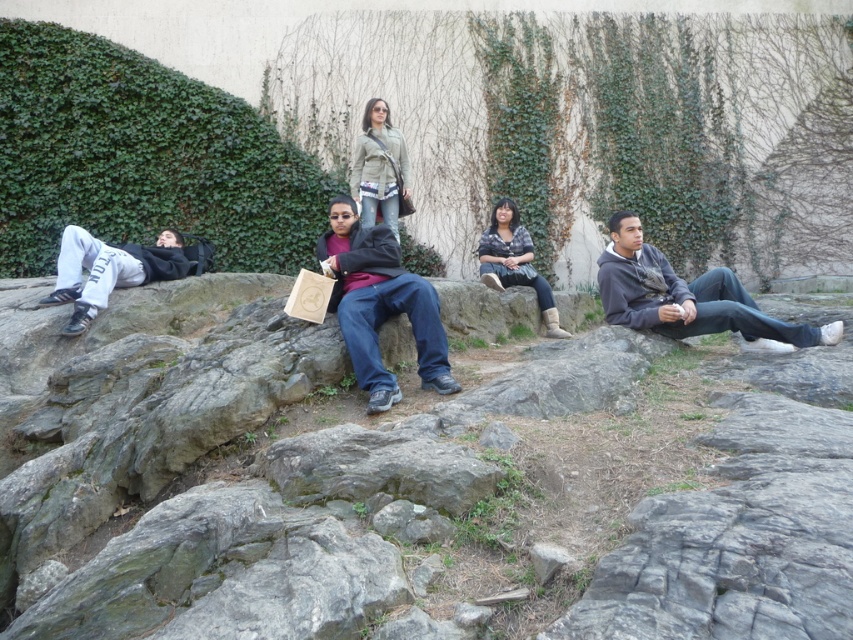
Is gray rock at center below matte green jacket at center?

Yes, gray rock at center is below matte green jacket at center.

Does point (366, 435) come in front of point (390, 184)?

Yes, point (366, 435) is in front of point (390, 184).

You are a GUI agent. You are given a task and a screenshot of the screen. Output one action in this format:
    pyautogui.click(x=<x>, y=<y>)
    Task: Click on the gray rock at center
    
    Given the screenshot: What is the action you would take?
    pyautogui.click(x=426, y=492)

Is matte black jacket at center above matte green jacket at center?

Actually, matte black jacket at center is below matte green jacket at center.

Is matte black jacket at center positioned at the back of matte green jacket at center?

No, it is in front of matte green jacket at center.

This screenshot has height=640, width=853. Describe the element at coordinates (380, 305) in the screenshot. I see `matte black jacket at center` at that location.

Where is `matte black jacket at center`? matte black jacket at center is located at coordinates (380, 305).

Is green leafy ivy at upper left in front of matte green jacket at center?

No, it is not.

Is green leafy ivy at upper left smaller than matte green jacket at center?

No.

The image size is (853, 640). I want to click on green leafy ivy at upper left, so click(141, 157).

I want to click on green leafy ivy at upper left, so click(141, 157).